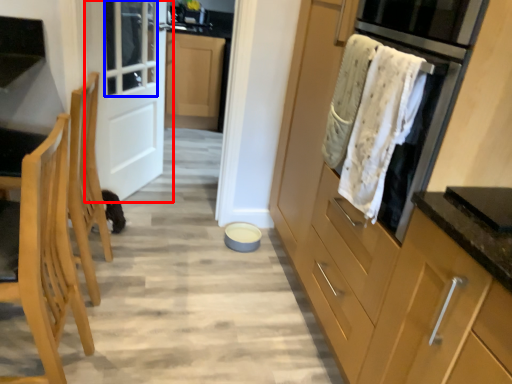
Question: Among these objects, which one is nearest to the camera, door (highlighted by a red box) or window (highlighted by a blue box)?

Choices:
 (A) door
 (B) window

Answer: (A)